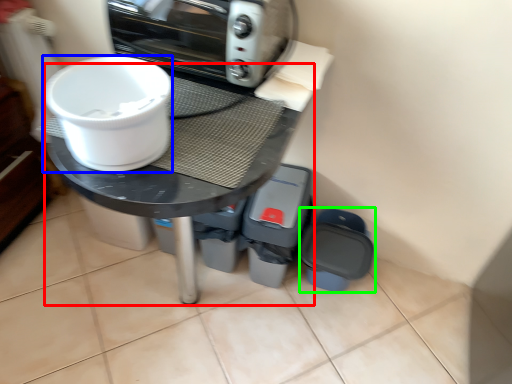
Question: Which object is the closest to the round table (highlighted by a red box)? Choose among these: toilet bowl (highlighted by a blue box) or appliance (highlighted by a green box).

Choices:
 (A) toilet bowl
 (B) appliance

Answer: (A)